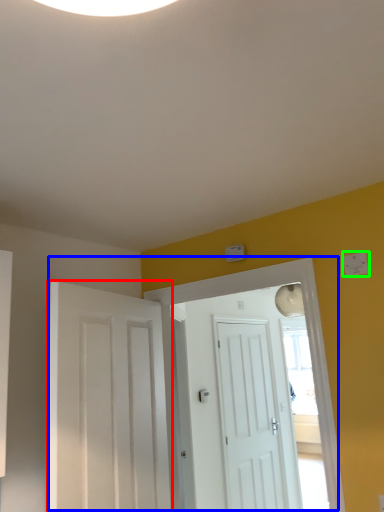
Question: Which object is the closest to the door (highlighted by a red box)? Choose among these: door (highlighted by a blue box) or light switch (highlighted by a green box).

Choices:
 (A) door
 (B) light switch

Answer: (A)